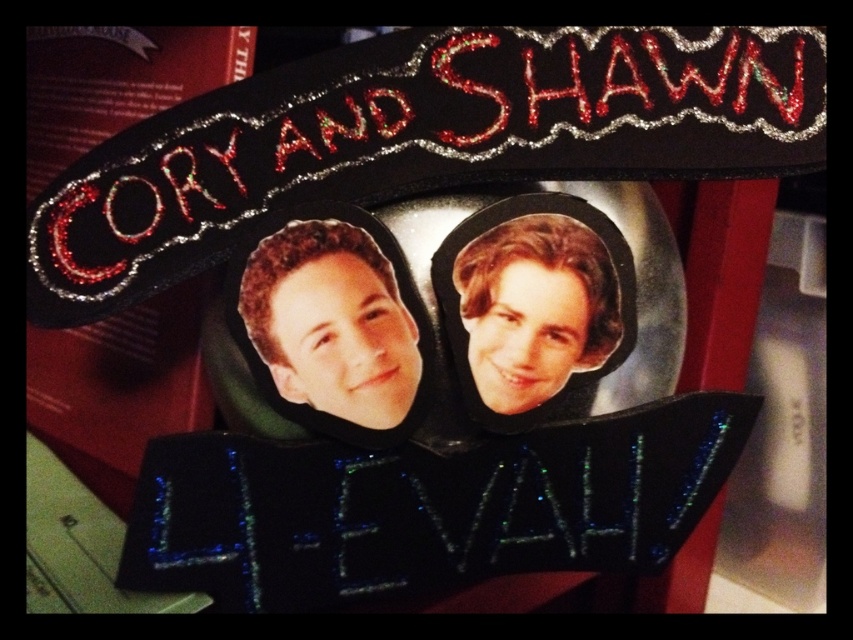
Question: Can you confirm if matte plastic head at center is wider than shiny brown hair at upper center?

Choices:
 (A) no
 (B) yes

Answer: (B)

Question: Is matte plastic head at center bigger than shiny brown hair at upper center?

Choices:
 (A) yes
 (B) no

Answer: (A)

Question: Which object is farther from the camera taking this photo?

Choices:
 (A) matte plastic head at center
 (B) shiny brown hair at upper center

Answer: (B)

Question: Does matte plastic head at center lie in front of shiny brown hair at upper center?

Choices:
 (A) yes
 (B) no

Answer: (A)